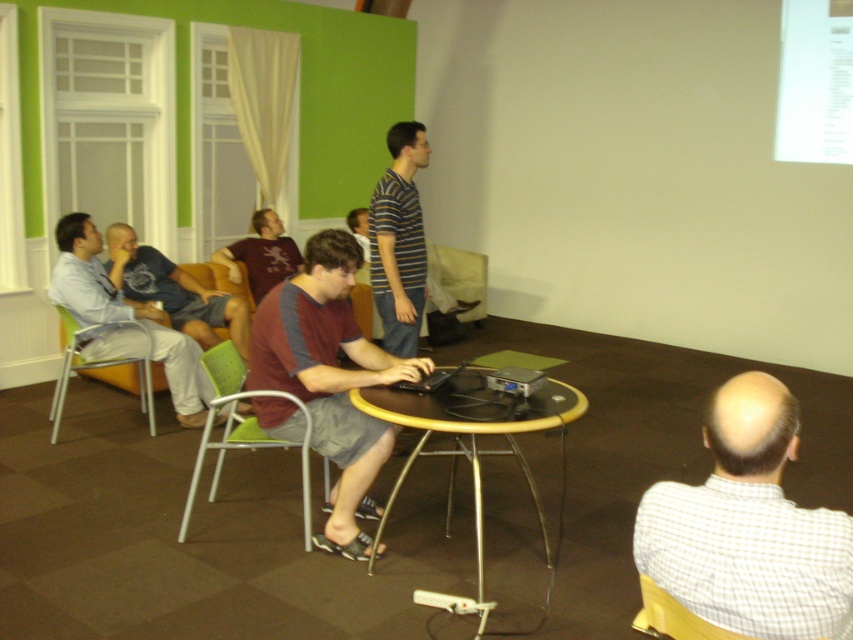
Describe the element at coordinates (173, 291) in the screenshot. I see `matte blue shirt at left` at that location.

Where is `matte blue shirt at left`? This screenshot has width=853, height=640. matte blue shirt at left is located at coordinates [173, 291].

Is matte blue shirt at left shorter than maroon jersey at center?

Incorrect, matte blue shirt at left's height does not fall short of maroon jersey at center's.

Is matte blue shirt at left below maroon jersey at center?

Yes.

This screenshot has height=640, width=853. In order to click on matte blue shirt at left in this screenshot , I will do `click(173, 291)`.

I want to click on matte blue shirt at left, so click(173, 291).

Where is `striped cotton shirt at center`? The image size is (853, 640). striped cotton shirt at center is located at coordinates (399, 241).

This screenshot has width=853, height=640. I want to click on striped cotton shirt at center, so click(399, 241).